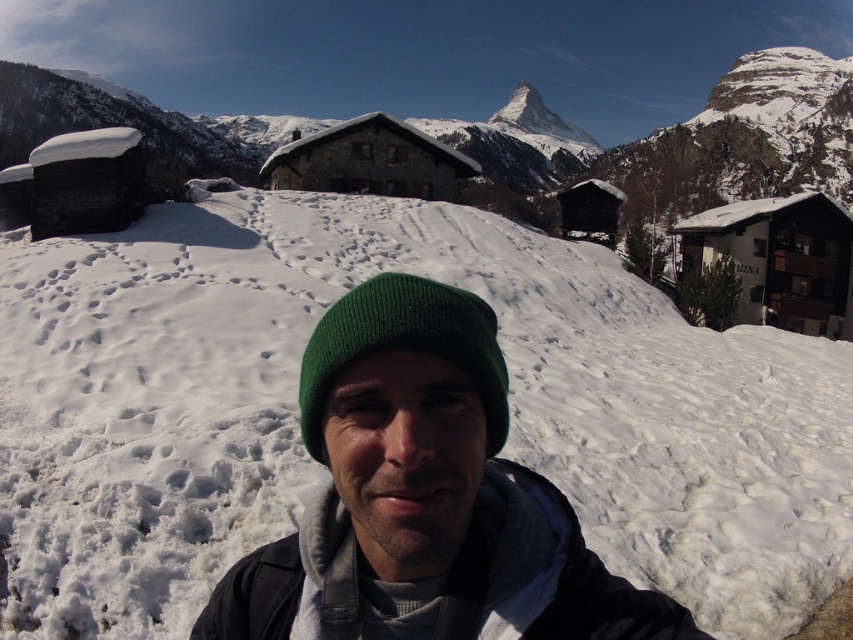
Question: Is white fluffy snow at center below green knitted hat at center?

Choices:
 (A) no
 (B) yes

Answer: (A)

Question: Which of the following is the closest to the observer?

Choices:
 (A) (340, 486)
 (B) (218, 497)

Answer: (A)

Question: Does green knit cap at center have a larger size compared to green knitted hat at center?

Choices:
 (A) yes
 (B) no

Answer: (A)

Question: Can you confirm if white fluffy snow at center is smaller than green knitted hat at center?

Choices:
 (A) yes
 (B) no

Answer: (B)

Question: Which of the following is the farthest from the observer?

Choices:
 (A) (447, 316)
 (B) (496, 444)

Answer: (B)

Question: Which point is farther to the camera?

Choices:
 (A) white fluffy snow at center
 (B) green knitted hat at center
 (C) green knit cap at center

Answer: (A)